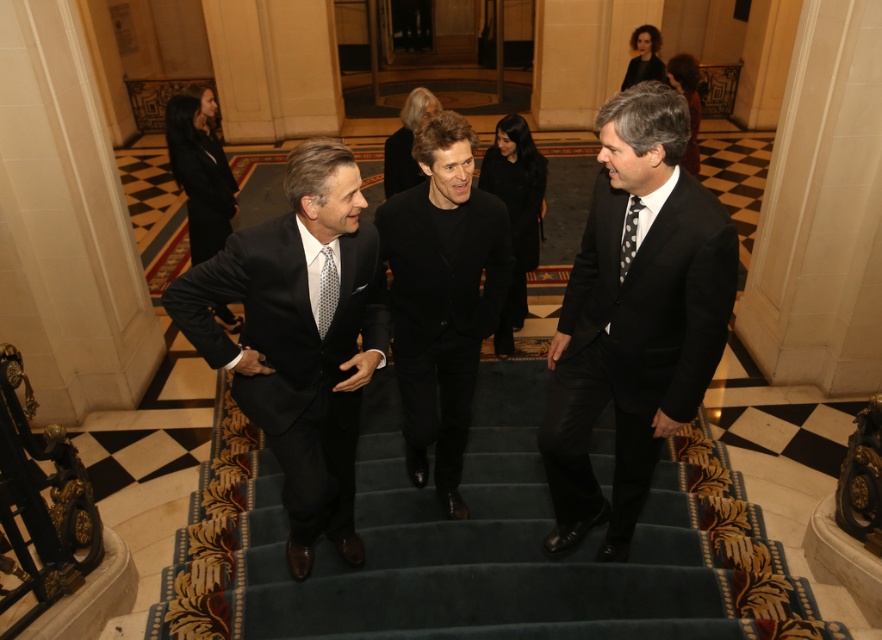
Looking at this image, you are a tailor observing the two gentlemen in the image. You need to determine which tie, the gray dotted tie at center or the black dotted tie at center, requires more fabric to make. Based on their widths, which one would you choose?

The gray dotted tie at center has a greater width than the black dotted tie at center, so it would require more fabric to make.

In the scene described, there are two men in formal attire. One is wearing a black wool suit at center and the other has a gray dotted tie at center. From the perspective of someone standing at the bottom of the staircase, which clothing item is positioned to the right?

The black wool suit at center is to the right of the gray dotted tie at center.

You are a photographer standing at the bottom of the staircase. You want to take a photo of both the gray dotted tie at center and the black dotted tie at center in the same frame. The camera has a maximum focus range of 1 meter. Can you capture both ties in focus without moving the camera?

The gray dotted tie at center is 1.05 meters away from the black dotted tie at center. Since the distance between them exceeds the camera maximum focus range of 1 meter, you cannot capture both ties in focus without moving the camera.